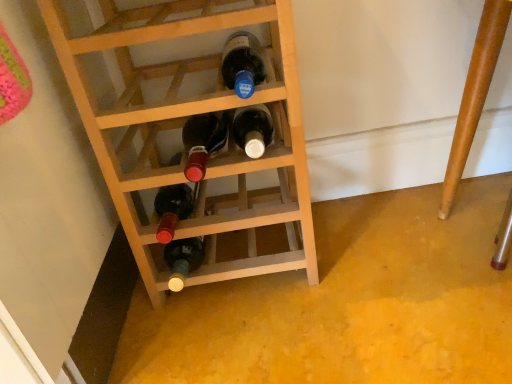
The width and height of the screenshot is (512, 384). In order to click on vacant space in front of wooden wine rack at center in this screenshot , I will do `click(265, 329)`.